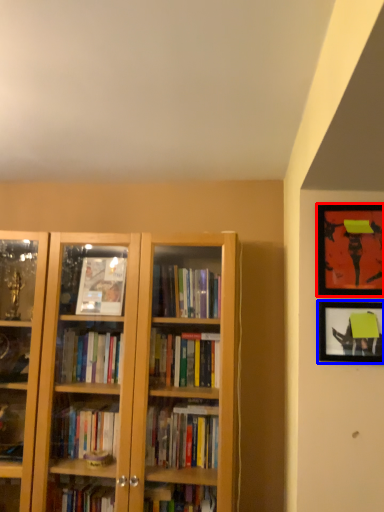
Question: Among these objects, which one is farthest to the camera, picture frame (highlighted by a red box) or picture frame (highlighted by a blue box)?

Choices:
 (A) picture frame
 (B) picture frame

Answer: (B)